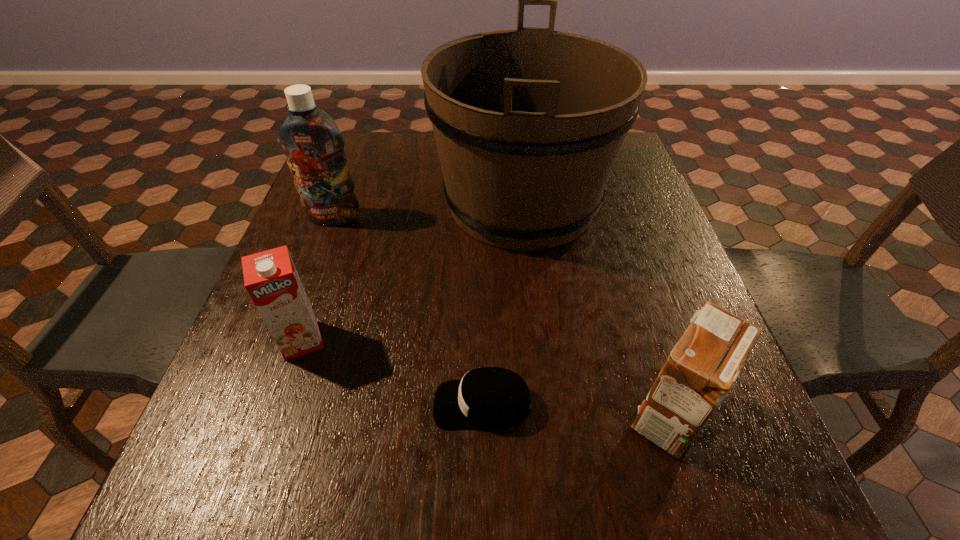
Find the location of a particular element. vacant area between the bucket and the farther carton is located at coordinates (412, 272).

Identify the location of free space between the right carton and the shampoo. The width and height of the screenshot is (960, 540). (501, 316).

At what (x,y) coordinates should I click in order to perform the action: click on vacant region between the cap and the bucket. Please return your answer as a coordinate pair (x, y). Looking at the image, I should click on (502, 304).

The width and height of the screenshot is (960, 540). Find the location of `vacant space that is in between the tallest object and the second tallest object`. vacant space that is in between the tallest object and the second tallest object is located at coordinates (428, 210).

I want to click on unoccupied area between the bucket and the cap, so click(x=502, y=304).

Identify the location of the third closest object to the shortest object. (528, 123).

Find the location of a particular element. This screenshot has width=960, height=540. the fourth closest object to the farther carton is located at coordinates (701, 369).